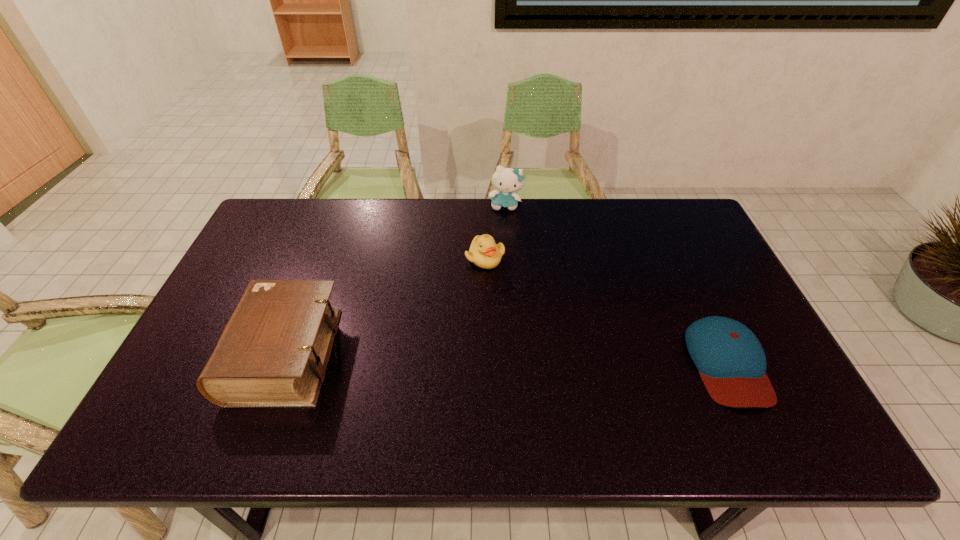
I want to click on free space between the farthest object and the rightmost object, so click(616, 284).

What are the coordinates of `free space between the duckling and the shortest object` in the screenshot? It's located at (606, 310).

The height and width of the screenshot is (540, 960). In order to click on unoccupied position between the second farthest object and the shortest object in this screenshot , I will do `click(606, 310)`.

Where is `free spot between the duckling and the shortest object`? free spot between the duckling and the shortest object is located at coordinates (606, 310).

Identify the location of free space between the Bible and the kitten. (396, 280).

The width and height of the screenshot is (960, 540). In order to click on free space between the shortest object and the Bible in this screenshot , I will do click(x=506, y=359).

Locate an element on the screen. free spot between the Bible and the kitten is located at coordinates (396, 280).

In order to click on blank region between the kitten and the duckling in this screenshot , I will do `click(495, 232)`.

Identify which object is located as the third nearest to the second tallest object. Please provide its 2D coordinates. Your answer should be formatted as a tuple, i.e. [(x, y)], where the tuple contains the x and y coordinates of a point satisfying the conditions above.

[(731, 362)]

Identify which object is located as the nearest to the third tallest object. Please provide its 2D coordinates. Your answer should be formatted as a tuple, i.e. [(x, y)], where the tuple contains the x and y coordinates of a point satisfying the conditions above.

[(506, 180)]